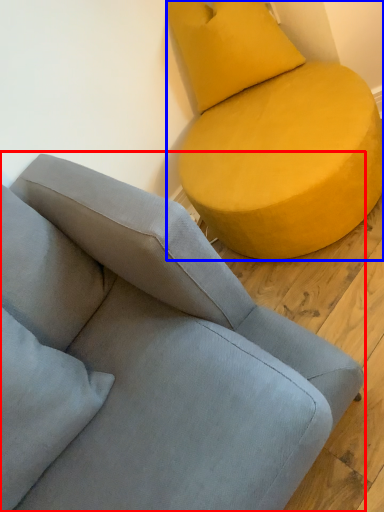
Question: Which point is further to the camera, studio couch (highlighted by a red box) or studio couch (highlighted by a blue box)?

Choices:
 (A) studio couch
 (B) studio couch

Answer: (B)